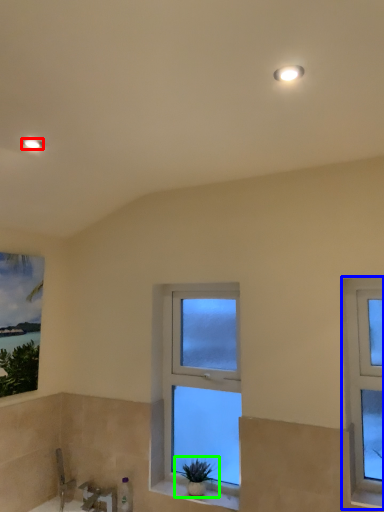
Question: Estimate the real-world distances between objects in this image. Which object is farther from light fixture (highlighted by a red box), window (highlighted by a blue box) or houseplant (highlighted by a green box)?

Choices:
 (A) window
 (B) houseplant

Answer: (B)